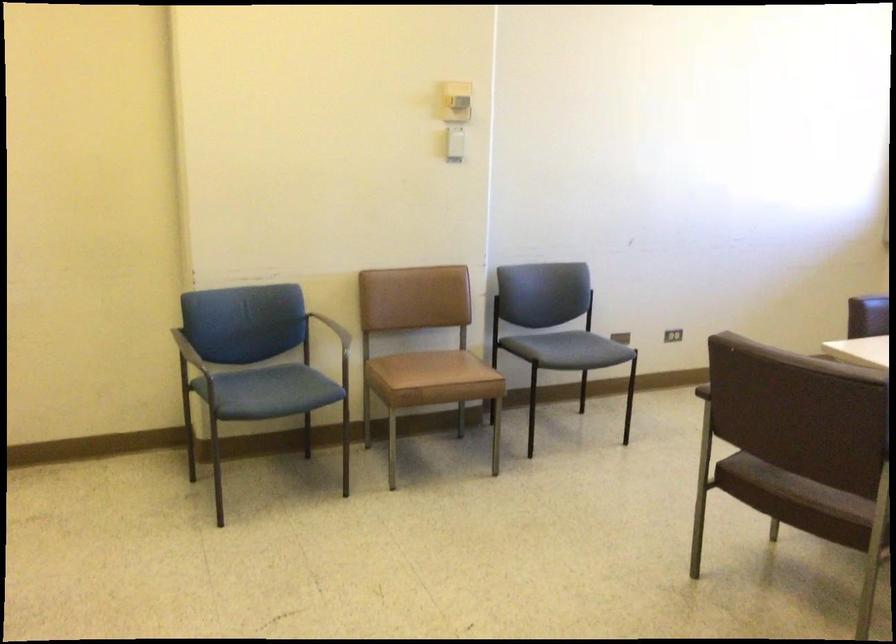
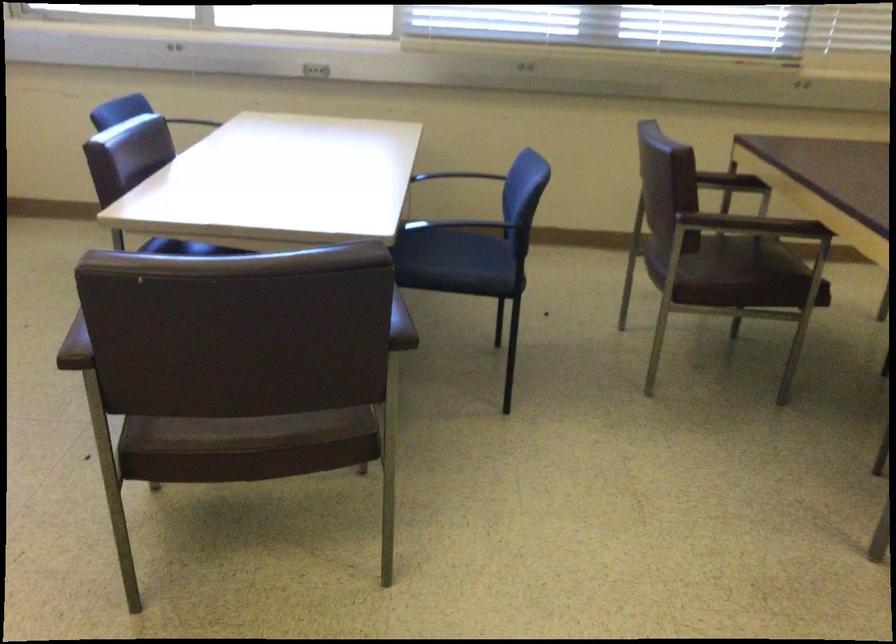
Locate, in the second image, the point that corresponds to pixel 810 487 in the first image.

(254, 431)